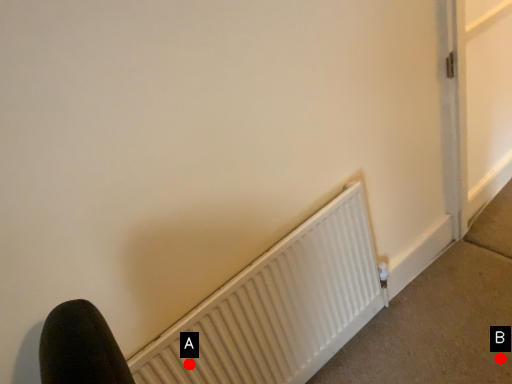
Question: Two points are circled on the image, labeled by A and B beside each circle. Among these points, which one is farthest from the camera?

Choices:
 (A) A is further
 (B) B is further

Answer: (B)